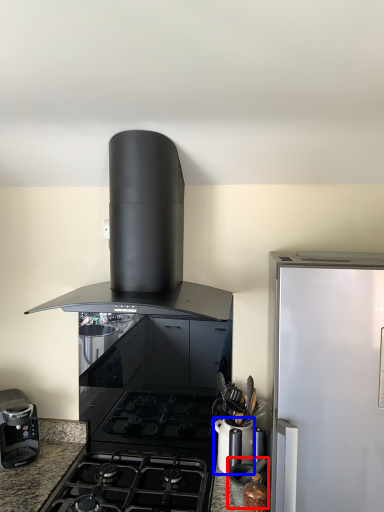
Question: Which object is closer to the camera taking this photo, appliance (highlighted by a red box) or kitchen appliance (highlighted by a blue box)?

Choices:
 (A) appliance
 (B) kitchen appliance

Answer: (A)